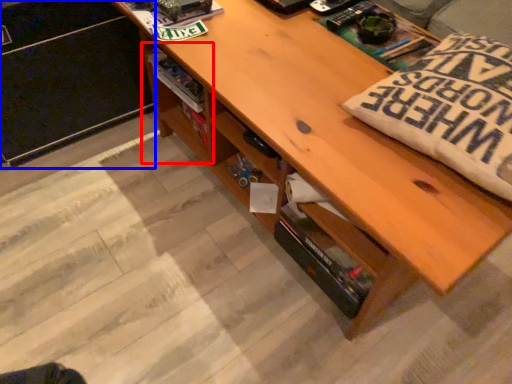
Question: Which point is closer to the camera, shelf (highlighted by a red box) or file cabinet (highlighted by a blue box)?

Choices:
 (A) shelf
 (B) file cabinet

Answer: (B)